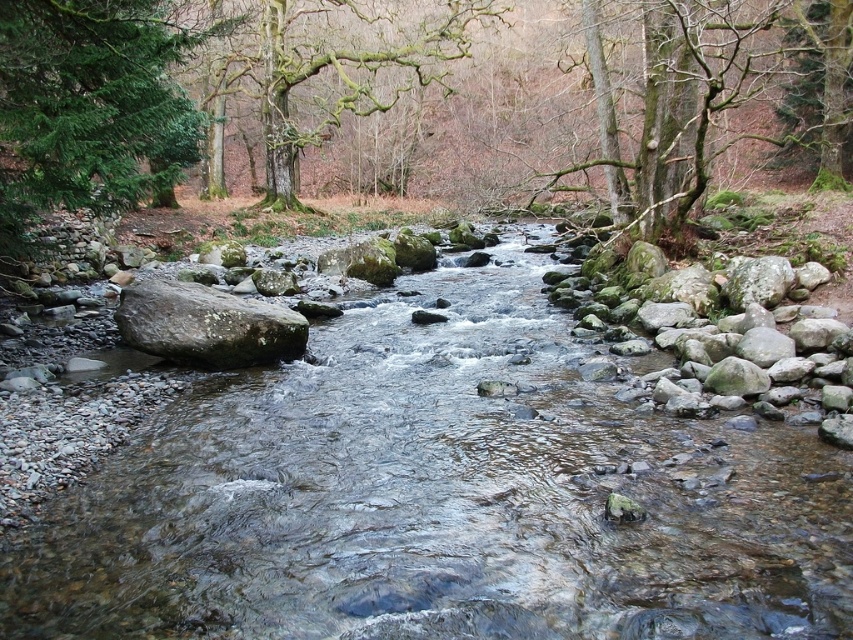
You are a hiker who wants to take a photo of both the green mossy bark tree at upper right and the mossy bark tree at upper center. Since you have a camera with a limited zoom, you need to know which tree is closer to adjust your focus. Can you tell me which tree is nearer to you?

The green mossy bark tree at upper right is closer to the viewer than the mossy bark tree at upper center, so you should focus on it first.

You are a hiker who wants to cross the stream using the rocks. You see the brown rough rock at left and the green mossy tree at upper right. Which rock should you step on first to start crossing?

The brown rough rock at left should be stepped on first since it is positioned on the left side of the green mossy tree at upper right, making it the closest to the starting point on the left bank.

You are a hiker who wants to take a photo of both the mossy bark tree at upper center and the green mossy tree at upper right. Since you have a wide angle lens, will you be able to capture both trees in the same frame?

The mossy bark tree at upper center is above the green mossy tree at upper right, so they are positioned vertically. Since your wide angle lens can capture a wide horizontal field of view, you might need to adjust your camera angle to include both trees in the frame as they are stacked vertically rather than spread horizontally.